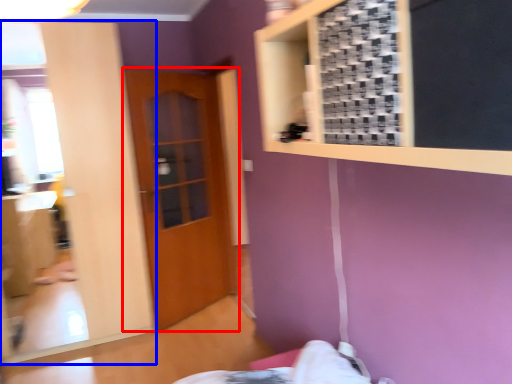
Question: Which point is closer to the camera, door (highlighted by a red box) or mirror (highlighted by a blue box)?

Choices:
 (A) door
 (B) mirror

Answer: (B)